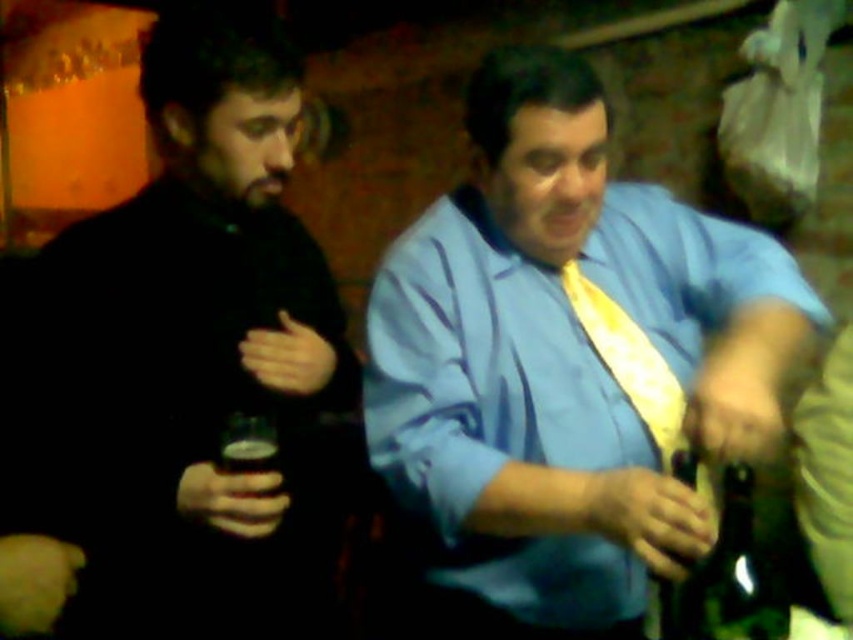
You are at a party and need to choose between the green glass bottle at lower right and the green glass bottle at right to grab a drink. Which bottle is wider?

The green glass bottle at lower right is wider than the green glass bottle at right.

You are at a social event and notice two items in the scene. The black matte shirt at left and the yellow satin tie at center. Which item appears taller in the image?

The black matte shirt at left is taller than the yellow satin tie at center according to the description provided.

You are a bartender at the event and need to place the green glass bottle at lower right and the yellow satin tie at center on a shelf. Which object should you place first if you want to stack them vertically based on their height?

The yellow satin tie at center should be placed first since it is taller than the green glass bottle at lower right, allowing the bottle to be stacked on top of it.